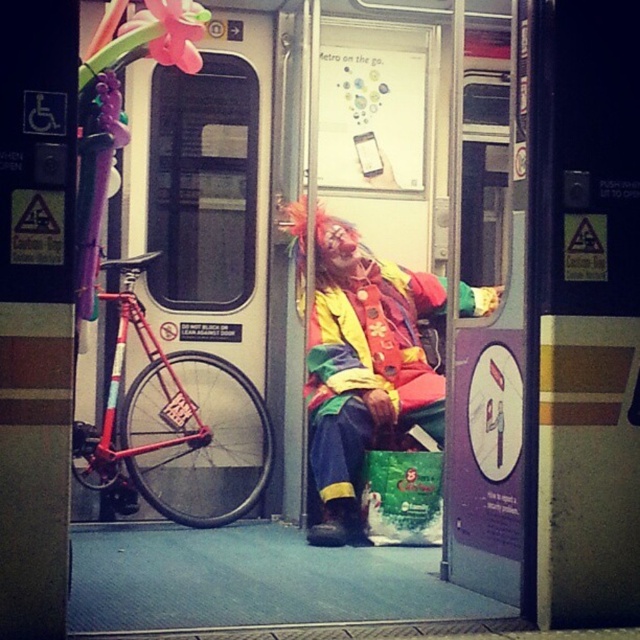
Is matte clown costume at center bigger than shiny red bicycle at left?

Yes, matte clown costume at center is bigger than shiny red bicycle at left.

This screenshot has height=640, width=640. What do you see at coordinates (364, 371) in the screenshot?
I see `matte clown costume at center` at bounding box center [364, 371].

Between point (381, 428) and point (186, 499), which one is positioned behind?

Positioned behind is point (186, 499).

Identify the location of matte clown costume at center. The height and width of the screenshot is (640, 640). (364, 371).